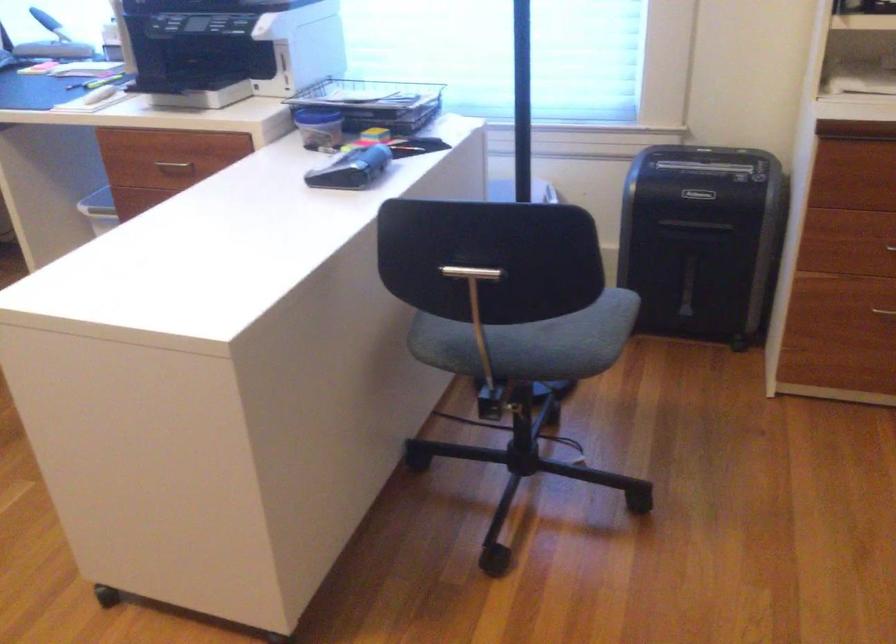
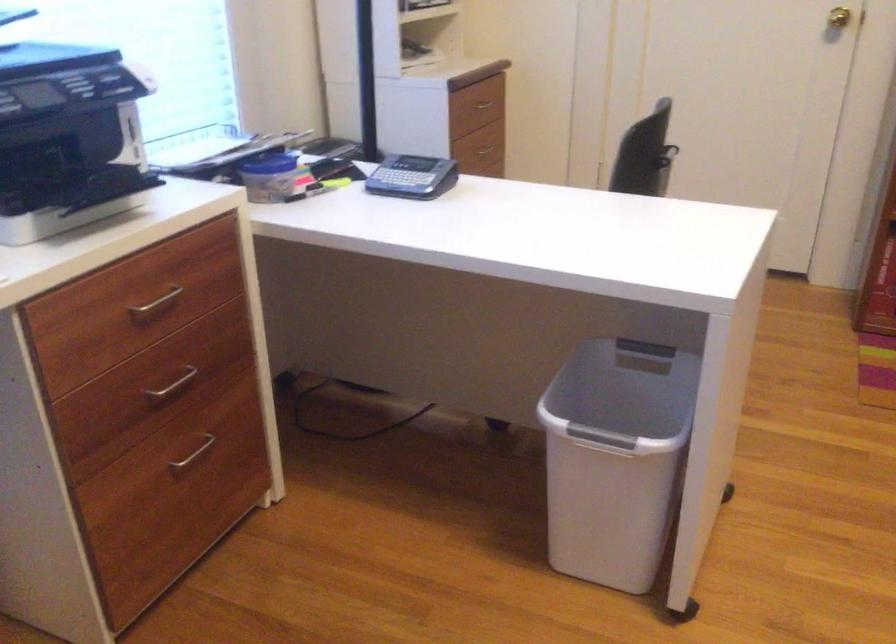
Where in the second image is the point corresponding to (x=307, y=109) from the first image?

(270, 164)